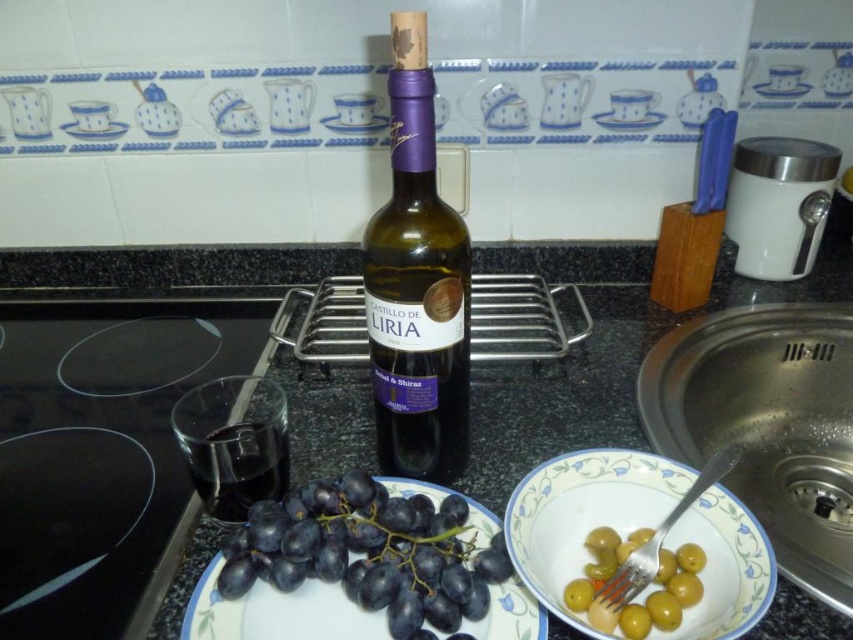
Question: Is white ceramic bowl at lower right to the left of green glossy olives at lower right from the viewer's perspective?

Choices:
 (A) no
 (B) yes

Answer: (A)

Question: Can you confirm if stainless steel sink at lower right is thinner than porcelain plate at upper center?

Choices:
 (A) no
 (B) yes

Answer: (A)

Question: Among these objects, which one is nearest to the camera?

Choices:
 (A) granite countertop at center
 (B) white ceramic plate at upper right
 (C) purple matte wine bottle at center
 (D) porcelain plate at upper center

Answer: (C)

Question: Is transparent glass at left smaller than green glossy olives at lower right?

Choices:
 (A) yes
 (B) no

Answer: (B)

Question: Among these points, which one is nearest to the camera?

Choices:
 (A) (373, 294)
 (B) (773, 442)
 (C) (329, 529)

Answer: (C)

Question: Which object is the farthest from the white ceramic plate at center?

Choices:
 (A) porcelain plate at upper center
 (B) white ceramic plate at upper center
 (C) green glossy olives at lower right

Answer: (C)